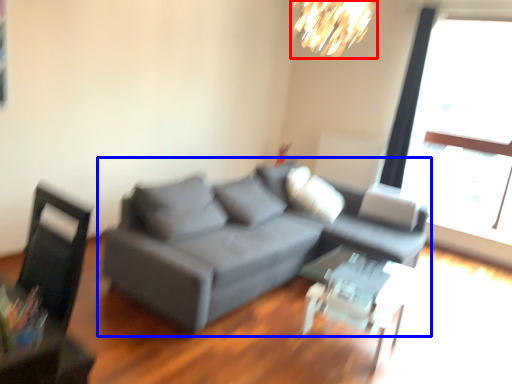
Question: Which point is closer to the camera, lamp (highlighted by a red box) or studio couch (highlighted by a blue box)?

Choices:
 (A) lamp
 (B) studio couch

Answer: (B)